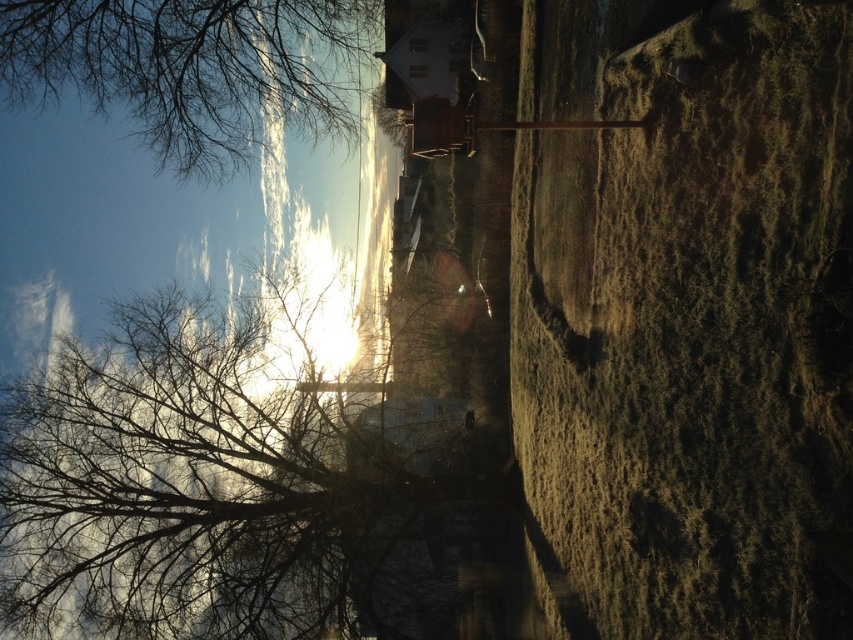
Question: Which point is closer to the camera?

Choices:
 (A) bare branches at left
 (B) bare branches at upper left

Answer: (B)

Question: Is bare branches at left bigger than bare branches at upper left?

Choices:
 (A) yes
 (B) no

Answer: (A)

Question: Which object appears closest to the camera in this image?

Choices:
 (A) bare branches at left
 (B) bare branches at upper left

Answer: (B)

Question: Is bare branches at left wider than bare branches at upper left?

Choices:
 (A) no
 (B) yes

Answer: (B)

Question: Can you confirm if bare branches at left is positioned below bare branches at upper left?

Choices:
 (A) yes
 (B) no

Answer: (A)